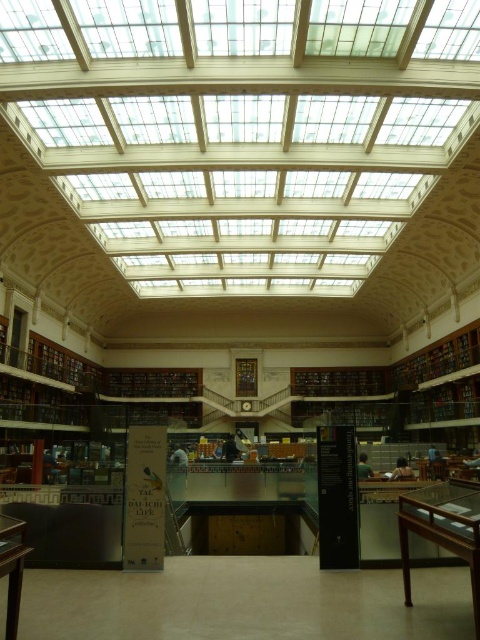
Question: Which point is farther to the camera?

Choices:
 (A) pos(8,540)
 (B) pos(410,529)

Answer: (B)

Question: From the image, what is the correct spatial relationship of wooden table at lower right in relation to wooden table at lower left?

Choices:
 (A) above
 (B) below

Answer: (B)

Question: In this image, where is wooden table at lower right located relative to wooden table at lower left?

Choices:
 (A) below
 (B) above

Answer: (A)

Question: Is wooden table at lower right behind wooden table at lower left?

Choices:
 (A) yes
 (B) no

Answer: (B)

Question: Among these objects, which one is farthest from the camera?

Choices:
 (A) wooden table at lower right
 (B) wooden table at lower left

Answer: (B)